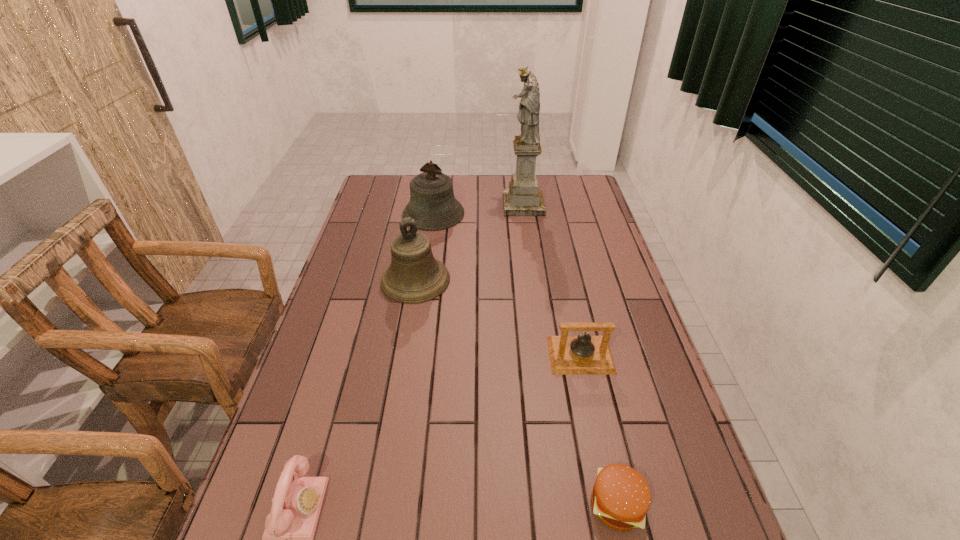
I want to click on vacant space situated on the right of the farthest bell, so click(x=477, y=214).

You are a GUI agent. You are given a task and a screenshot of the screen. Output one action in this format:
    pyautogui.click(x=<x>, y=<y>)
    Task: Click on the free space located 0.090m on the front of the nearest bell
    
    Given the screenshot: What is the action you would take?
    pyautogui.click(x=591, y=406)

Find the location of a particular element. This screenshot has height=540, width=960. vacant space situated 0.230m on the back of the shortest object is located at coordinates (589, 385).

Where is `sculpture that is at the far edge`? This screenshot has height=540, width=960. sculpture that is at the far edge is located at coordinates (523, 198).

You are a GUI agent. You are given a task and a screenshot of the screen. Output one action in this format:
    pyautogui.click(x=<x>, y=<y>)
    Task: Click on the bell present at the far edge
    
    Given the screenshot: What is the action you would take?
    433,206

At what (x,y) coordinates should I click in order to perform the action: click on object that is at the left edge. Please return your answer as a coordinate pair (x, y). Image resolution: width=960 pixels, height=540 pixels. Looking at the image, I should click on (414, 276).

Identify the location of bell that is positioned at the right edge. (569, 355).

Locate an element on the screen. This screenshot has width=960, height=540. hamburger that is at the right edge is located at coordinates (621, 497).

Identify the location of vacant area at the far edge. The height and width of the screenshot is (540, 960). (550, 183).

The height and width of the screenshot is (540, 960). What are the coordinates of `blank space at the left edge` in the screenshot? It's located at (354, 379).